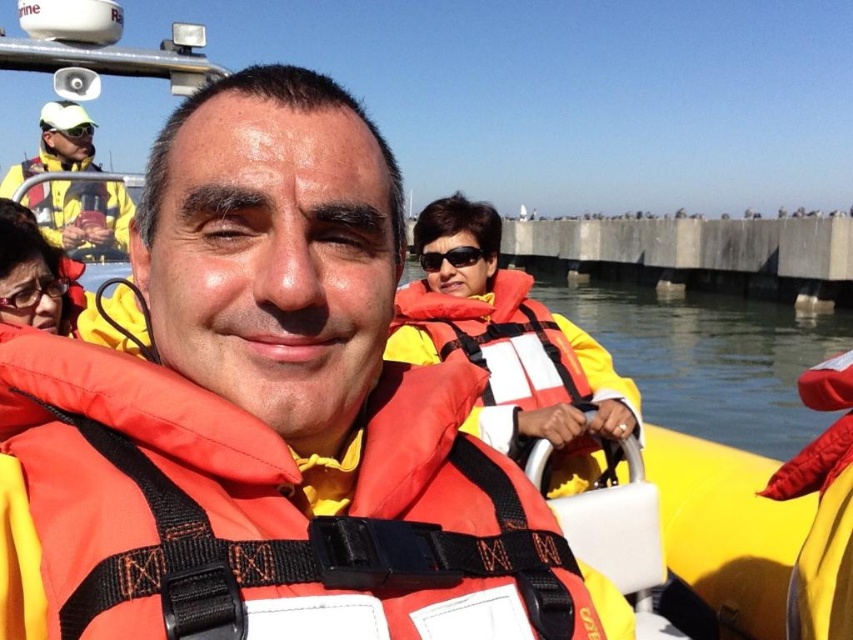
You are a tour guide on the boat and need to ensure all jackets are properly sized for safety. Which jacket, the orange matte life jacket at center or the yellow matte jacket at upper left, is bigger?

The orange matte life jacket at center is larger than the yellow matte jacket at upper left.

You are a photographer on a boat and need to ensure all equipment fits in your bag. Your bag has a compartment that can only hold items smaller than the orange life jacket at center. Can the matte black goggles at upper left fit in this compartment?

The orange life jacket at center is larger in size than matte black goggles at upper left, so the matte black goggles at upper left can fit in the compartment since they are smaller.

You are a photographer trying to capture a closeup shot of the orange life jacket at center and the black plastic sunglasses at center. If your camera has a maximum focus range of 50 centimeters, can you focus on both objects simultaneously?

The orange life jacket at center is 48.25 centimeters from the black plastic sunglasses at center. Since the distance between them is within the camera maximum focus range of 50 centimeters, both objects can be focused on simultaneously.